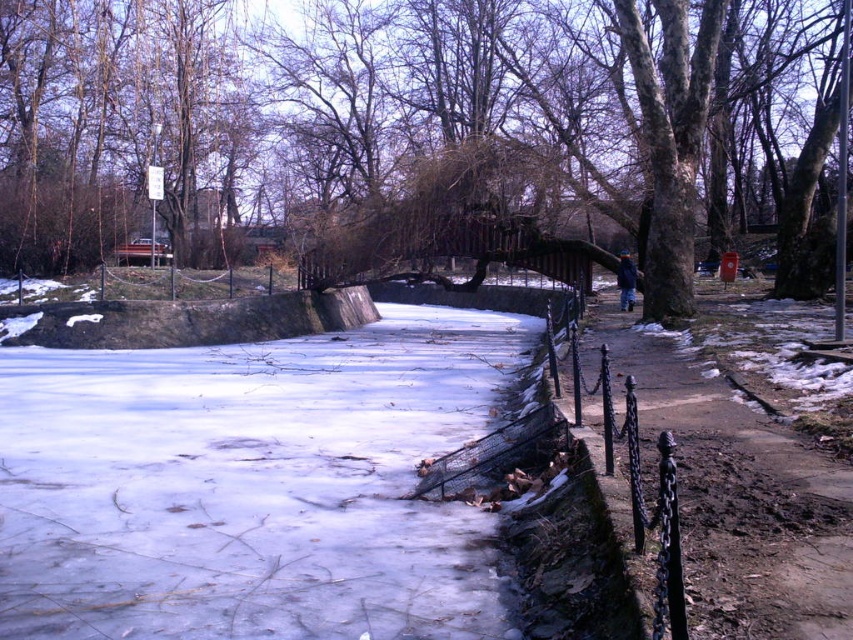
Who is positioned more to the right, black wrought iron fence at right or black wrought iron fence at lower right?

black wrought iron fence at right is more to the right.

Does black wrought iron fence at right appear under black wrought iron fence at lower right?

Correct, black wrought iron fence at right is located below black wrought iron fence at lower right.

This screenshot has height=640, width=853. Identify the location of black wrought iron fence at right. (734, 492).

Between brown textured tree at center and black wrought iron fence at right, which one has less height?

black wrought iron fence at right

Which is more to the right, brown textured tree at center or black wrought iron fence at right?

From the viewer's perspective, brown textured tree at center appears more on the right side.

Which is behind, point (741, 74) or point (733, 570)?

Positioned behind is point (741, 74).

Image resolution: width=853 pixels, height=640 pixels. I want to click on brown textured tree at center, so click(x=425, y=131).

Does brown textured tree at center appear over black wrought iron fence at lower right?

Yes, brown textured tree at center is above black wrought iron fence at lower right.

The image size is (853, 640). Describe the element at coordinates (425, 131) in the screenshot. I see `brown textured tree at center` at that location.

Locate an element on the screen. Image resolution: width=853 pixels, height=640 pixels. brown textured tree at center is located at coordinates (425, 131).